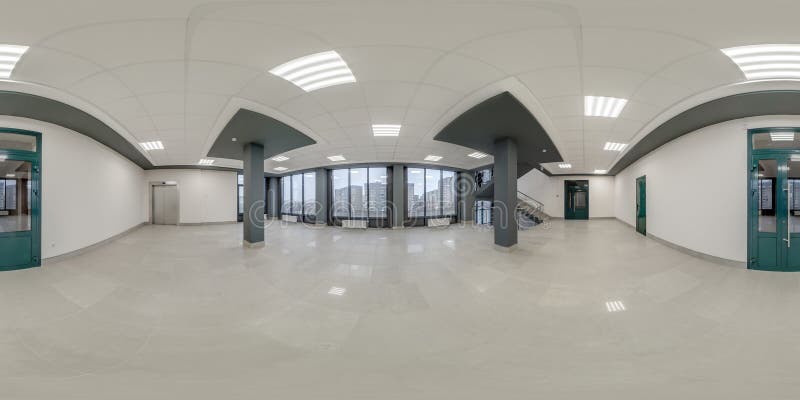
The height and width of the screenshot is (400, 800). Find the location of `floor`. floor is located at coordinates (214, 334).